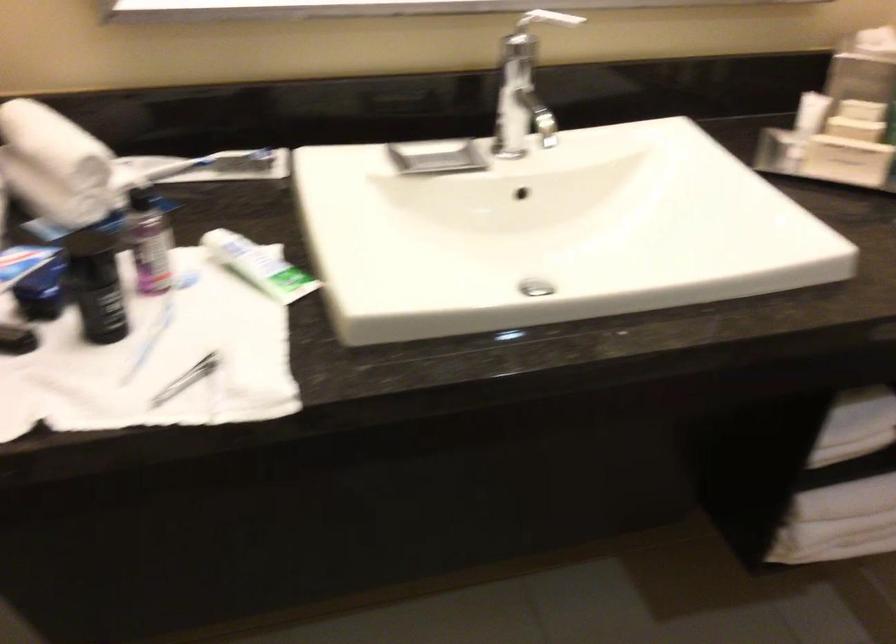
The width and height of the screenshot is (896, 644). What do you see at coordinates (533, 15) in the screenshot? I see `the soap dispenser pump` at bounding box center [533, 15].